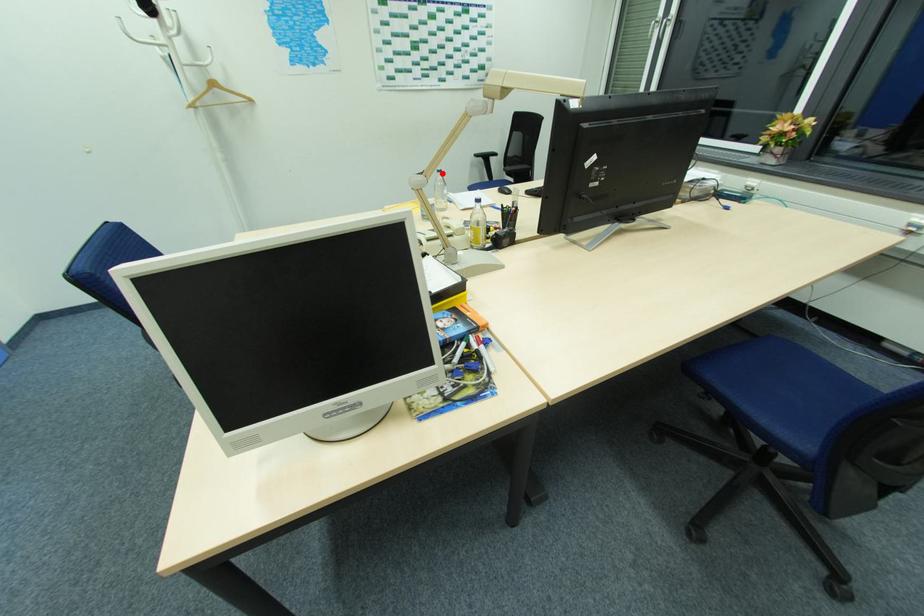
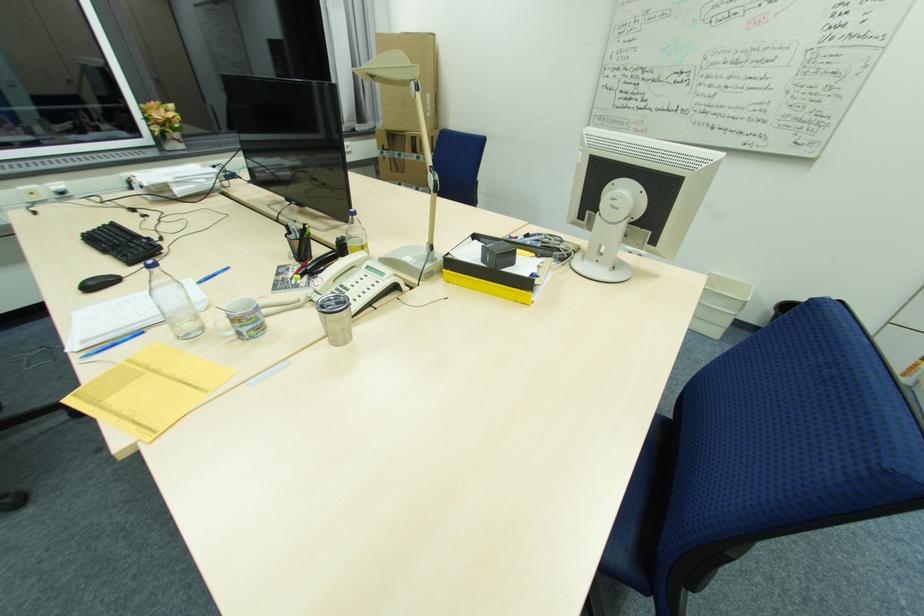
Question: I am providing you with two images of the same scene from different viewpoints. A red point is marked on the first image. Is the red point's position out of view in image 2?

Choices:
 (A) Yes
 (B) No

Answer: (B)